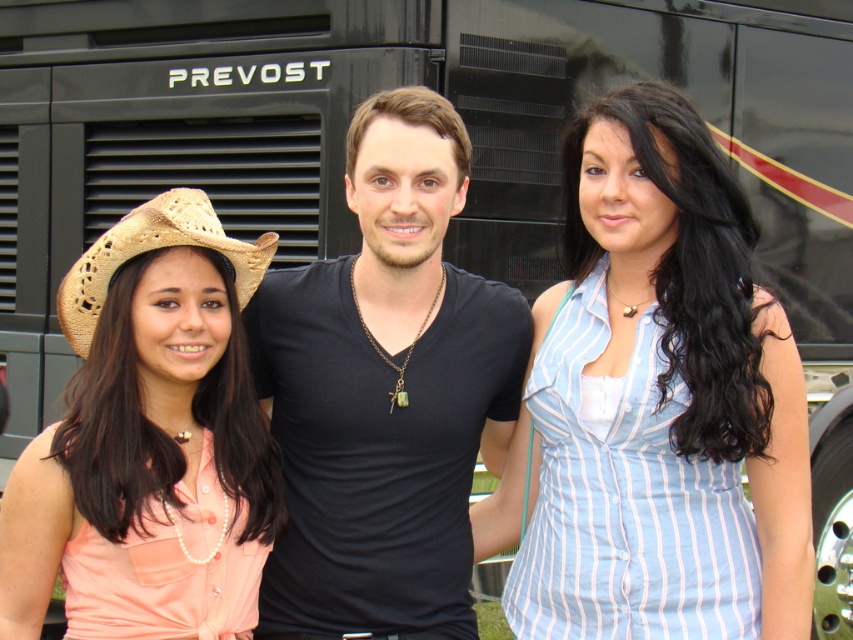
Can you confirm if light blue striped shirt at center is positioned to the right of black matte shirt at center?

Indeed, light blue striped shirt at center is positioned on the right side of black matte shirt at center.

Can you confirm if light blue striped shirt at center is taller than black matte shirt at center?

Indeed, light blue striped shirt at center has a greater height compared to black matte shirt at center.

The image size is (853, 640). In order to click on light blue striped shirt at center in this screenshot , I will do `click(660, 401)`.

Describe the element at coordinates (141, 397) in the screenshot. The height and width of the screenshot is (640, 853). I see `pink fabric shirt at left` at that location.

How distant is pink fabric shirt at left from braided straw cowboy hat at left?

They are 9.87 inches apart.

Find the location of a particular element. The width and height of the screenshot is (853, 640). pink fabric shirt at left is located at coordinates (141, 397).

Is light blue striped shirt at center positioned in front of pink fabric shirt at left?

No, it is behind pink fabric shirt at left.

What do you see at coordinates (660, 401) in the screenshot? The height and width of the screenshot is (640, 853). I see `light blue striped shirt at center` at bounding box center [660, 401].

Locate an element on the screen. This screenshot has width=853, height=640. light blue striped shirt at center is located at coordinates (660, 401).